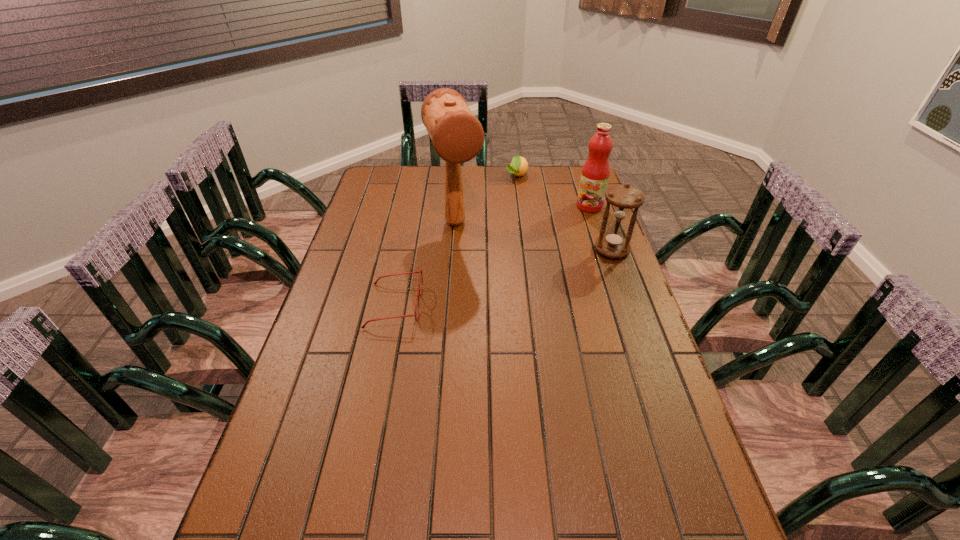
Where is `vacant space located 0.120m with leaves positioned above the lemon`? Image resolution: width=960 pixels, height=540 pixels. vacant space located 0.120m with leaves positioned above the lemon is located at coordinates (512, 198).

Find the location of a particular element. blank space located 0.260m with leaves positioned above the lemon is located at coordinates (507, 218).

Locate an element on the screen. vacant space located 0.290m on the front label of the second tallest object is located at coordinates (541, 249).

Identify the location of vacant point located on the front label of the second tallest object. pos(561,232).

I want to click on free space located 0.220m on the front label of the second tallest object, so click(x=552, y=240).

The width and height of the screenshot is (960, 540). I want to click on vacant space located on the strike surface of the mallet, so 476,280.

Locate an element on the screen. vacant space located 0.350m on the strike surface of the mallet is located at coordinates (492, 317).

Identify the location of vacant position located 0.380m on the strike surface of the mallet. (494, 325).

Where is `object that is at the far edge`? object that is at the far edge is located at coordinates (519, 165).

Where is `object that is at the left edge`? This screenshot has height=540, width=960. object that is at the left edge is located at coordinates (420, 271).